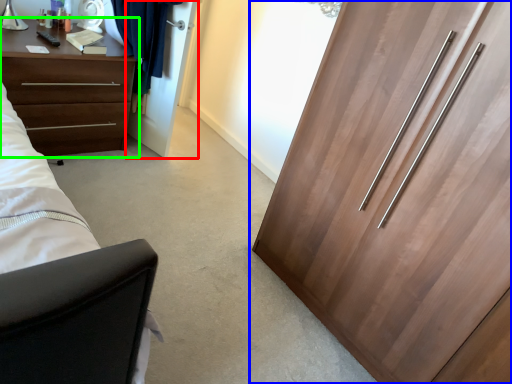
Question: Based on their relative distances, which object is farther from door (highlighted by a red box)? Choose from cupboard (highlighted by a blue box) and chest of drawers (highlighted by a green box).

Choices:
 (A) cupboard
 (B) chest of drawers

Answer: (A)